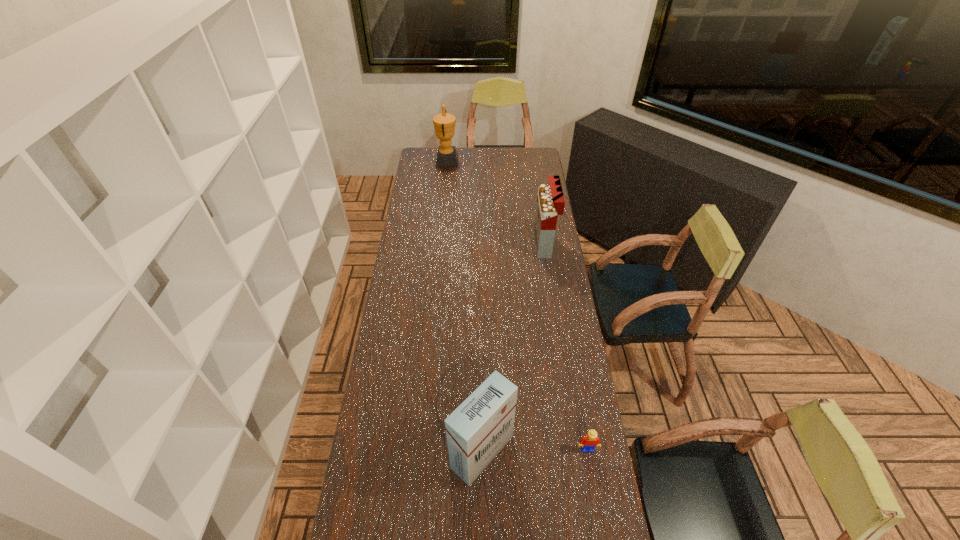
Where is `blank space located with the lid open on the farther cigarette case`? This screenshot has height=540, width=960. blank space located with the lid open on the farther cigarette case is located at coordinates (511, 244).

Find the location of a particular element. The image size is (960, 540). blank space located 0.130m on the right of the second object from left to right is located at coordinates (554, 452).

This screenshot has width=960, height=540. I want to click on free space located 0.240m on the front-facing side of the shortest object, so click(602, 537).

Find the location of a particular element. The width and height of the screenshot is (960, 540). object present at the far edge is located at coordinates (444, 123).

Locate an element on the screen. This screenshot has width=960, height=540. object that is at the left edge is located at coordinates (444, 123).

The image size is (960, 540). Identify the location of cigarette case that is positioned at the right edge. (550, 200).

Identify the location of Lego that is at the right edge. This screenshot has width=960, height=540. (587, 443).

Image resolution: width=960 pixels, height=540 pixels. Identify the location of object that is at the far left corner. (444, 123).

You are a GUI agent. You are given a task and a screenshot of the screen. Output one action in this format:
    pyautogui.click(x=<x>, y=<y>)
    Task: Click on the free space at the far edge
    
    Given the screenshot: What is the action you would take?
    pyautogui.click(x=511, y=165)

I want to click on free space at the left edge, so click(x=413, y=249).